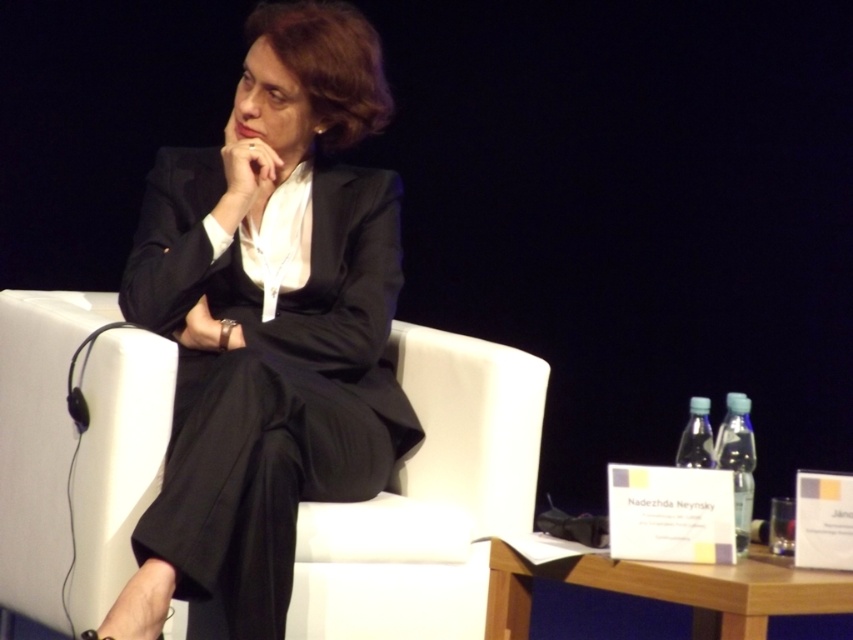
Question: Which point appears farthest from the camera in this image?

Choices:
 (A) pos(503,378)
 (B) pos(354,492)

Answer: (A)

Question: Which of the following is the closest to the observer?

Choices:
 (A) white fabric armchair at center
 (B) black pinstripe suit at center

Answer: (B)

Question: Is black pinstripe suit at center bigger than white fabric armchair at center?

Choices:
 (A) no
 (B) yes

Answer: (B)

Question: Which object appears farthest from the camera in this image?

Choices:
 (A) white fabric armchair at center
 (B) black pinstripe suit at center

Answer: (A)

Question: Observing the image, what is the correct spatial positioning of black pinstripe suit at center in reference to white fabric armchair at center?

Choices:
 (A) below
 (B) above

Answer: (B)

Question: Is black pinstripe suit at center to the left of white fabric armchair at center from the viewer's perspective?

Choices:
 (A) no
 (B) yes

Answer: (A)